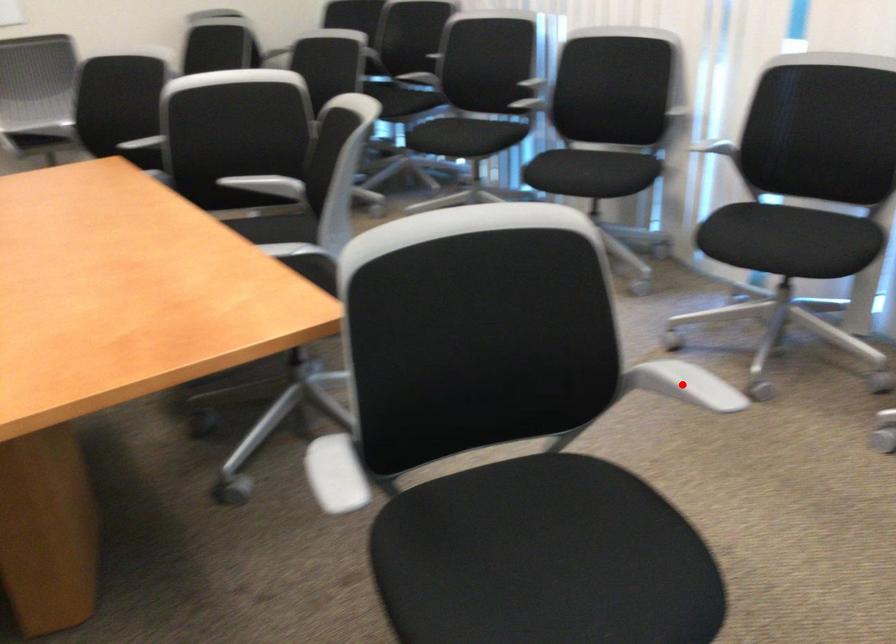
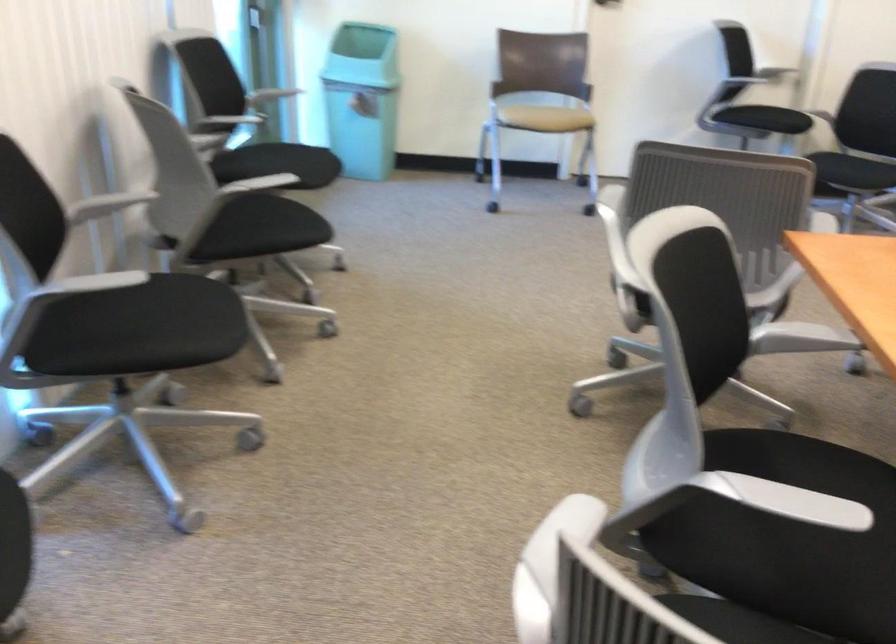
Question: I am providing you with two images of the same scene from different viewpoints. A red point is marked on the first image. Is the red point's position out of view in image 2?

Choices:
 (A) Yes
 (B) No

Answer: (A)